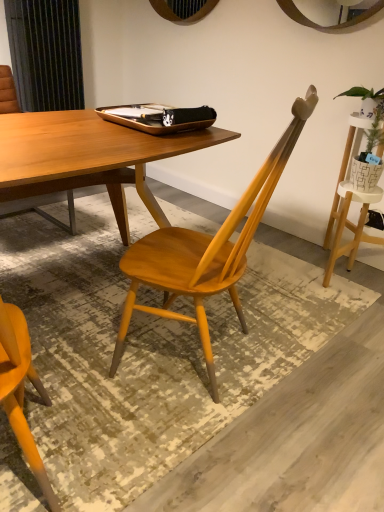
You are a GUI agent. You are given a task and a screenshot of the screen. Output one action in this format:
    pyautogui.click(x=<x>, y=<y>)
    Task: Click on the wooden tray at center
    Image resolution: width=384 pixels, height=512 pixels.
    Given the screenshot: What is the action you would take?
    pos(159,118)

Between wooden tray at center and green leafy plant in woven basket at upper right, which one is positioned in front?

Positioned in front is wooden tray at center.

Is wooden tray at center not within green leafy plant in woven basket at upper right?

Absolutely, wooden tray at center is external to green leafy plant in woven basket at upper right.

Are wooden tray at center and green leafy plant in woven basket at upper right beside each other?

No, wooden tray at center is not making contact with green leafy plant in woven basket at upper right.

From the image's perspective, is wooden tray at center located beneath green leafy plant in woven basket at upper right?

No.

Is wooden tray at center to the left or to the right of matte wood chair at center in the image?

wooden tray at center is to the left of matte wood chair at center.

From the image's perspective, is wooden tray at center above or below matte wood chair at center?

Based on their image positions, wooden tray at center is located above matte wood chair at center.

From a real-world perspective, is wooden tray at center above or below matte wood chair at center?

Clearly, from a real-world perspective, wooden tray at center is above matte wood chair at center.

Looking at their sizes, would you say wooden tray at center is wider or thinner than matte wood chair at center?

In the image, wooden tray at center appears to be more narrow than matte wood chair at center.

Would you say green leafy plant in woven basket at upper right is a long distance from wooden tray at center?

green leafy plant in woven basket at upper right is near wooden tray at center, not far away.

Which of these two, green leafy plant in woven basket at upper right or wooden tray at center, is smaller?

With smaller size is green leafy plant in woven basket at upper right.

Which object is more forward, green leafy plant in woven basket at upper right or wooden tray at center?

wooden tray at center.

Is green leafy plant in woven basket at upper right smaller than matte wood chair at center?

Indeed, green leafy plant in woven basket at upper right has a smaller size compared to matte wood chair at center.

Is green leafy plant in woven basket at upper right positioned behind matte wood chair at center?

Yes, green leafy plant in woven basket at upper right is behind matte wood chair at center.

Image resolution: width=384 pixels, height=512 pixels. In the image, there is a green leafy plant in woven basket at upper right. Find the location of `chair below it (from a real-world perspective)`. chair below it (from a real-world perspective) is located at coordinates (206, 250).

Can you confirm if matte wood chair at center is wider than green leafy plant in woven basket at upper right?

Yes, matte wood chair at center is wider than green leafy plant in woven basket at upper right.

Looking at this image, from the image's perspective, is matte wood chair at center located above or below green leafy plant in woven basket at upper right?

Based on their image positions, matte wood chair at center is located beneath green leafy plant in woven basket at upper right.

Are matte wood chair at center and green leafy plant in woven basket at upper right making contact?

Answer: No, matte wood chair at center is not touching green leafy plant in woven basket at upper right.

Does matte wood chair at center have a greater height compared to green leafy plant in woven basket at upper right?

Yes.

Is matte wood chair at center looking in the opposite direction of wooden tray at center?

No, matte wood chair at center is not facing away from wooden tray at center.

Would you say matte wood chair at center is a long distance from wooden tray at center?

matte wood chair at center is near wooden tray at center, not far away.

In the scene shown: Based on their sizes in the image, would you say matte wood chair at center is bigger or smaller than wooden tray at center?

Clearly, matte wood chair at center is larger in size than wooden tray at center.

Locate an element on the screen. This screenshot has width=384, height=512. tray that is above the green leafy plant in woven basket at upper right (from the image's perspective) is located at coordinates (159, 118).

Locate an element on the screen. The height and width of the screenshot is (512, 384). chair in front of the wooden tray at center is located at coordinates (206, 250).

From the image, which object appears to be nearer to green leafy plant in woven basket at upper right, matte wood chair at center or wooden tray at center?

wooden tray at center.

Based on their spatial positions, is green leafy plant in woven basket at upper right or wooden tray at center closer to matte wood chair at center?

wooden tray at center.

From the image, which object appears to be nearer to green leafy plant in woven basket at upper right, wooden tray at center or matte wood chair at center?

Based on the image, wooden tray at center appears to be nearer to green leafy plant in woven basket at upper right.

When comparing their distances from wooden tray at center, does green leafy plant in woven basket at upper right or matte wood chair at center seem closer?

matte wood chair at center is closer to wooden tray at center.

Based on their spatial positions, is wooden tray at center or green leafy plant in woven basket at upper right closer to matte wood chair at center?

The object closer to matte wood chair at center is wooden tray at center.

Based on their spatial positions, is matte wood chair at center or green leafy plant in woven basket at upper right closer to wooden tray at center?

matte wood chair at center is closer to wooden tray at center.

Locate an element on the screen. This screenshot has width=384, height=512. chair situated between wooden tray at center and green leafy plant in woven basket at upper right from left to right is located at coordinates (206, 250).